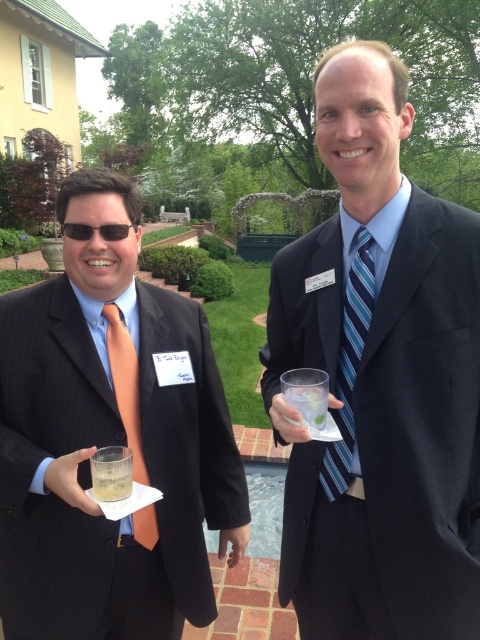
Is dark blue suit at center shorter than matte orange tie at left?

No, dark blue suit at center is not shorter than matte orange tie at left.

Which is behind, point (369, 540) or point (132, 531)?

Positioned behind is point (132, 531).

The width and height of the screenshot is (480, 640). In order to click on dark blue suit at center in this screenshot , I will do `click(379, 380)`.

Is translucent glass at center below clear plastic cup at center?

Yes, translucent glass at center is below clear plastic cup at center.

Who is more distant from viewer, (109, 488) or (309, 394)?

Positioned behind is point (309, 394).

The height and width of the screenshot is (640, 480). What are the coordinates of `translucent glass at center` in the screenshot? It's located at (111, 474).

Is matte black suit at center thinner than blue striped tie at right?

No.

Can you confirm if matte black suit at center is positioned below blue striped tie at right?

Correct, matte black suit at center is located below blue striped tie at right.

Does point (44, 592) come farther from viewer compared to point (335, 467)?

Yes.

The image size is (480, 640). I want to click on matte black suit at center, so click(109, 442).